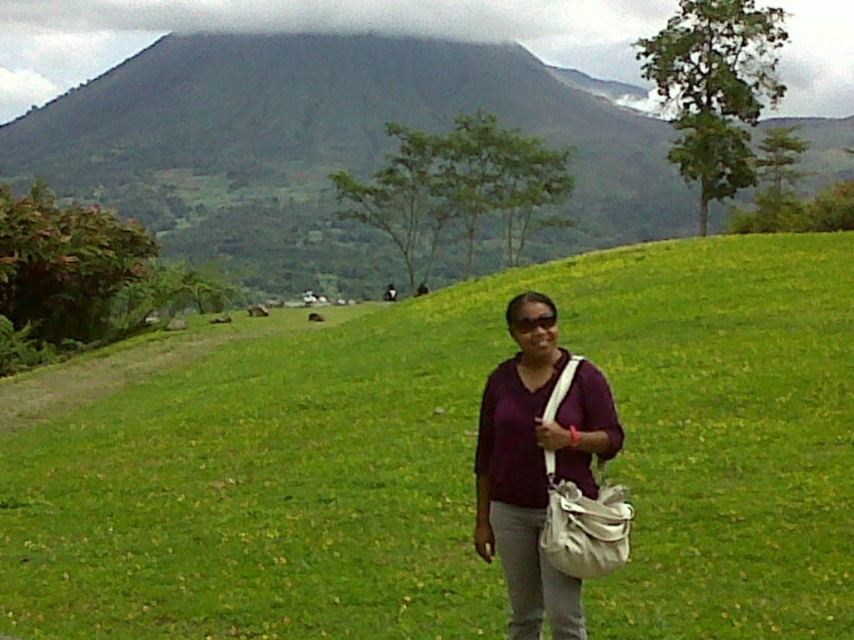
Looking at this image, you are standing at the point marked by the coordinates point (325,145) in the image. What is the terrain like under your feet?

The terrain under your feet at point (325,145) is green grassy hillside at center.

You are a photographer planning to take a picture of the green grassy hillside at center. What are the coordinates where you should focus your camera to capture it?

The green grassy hillside at center is located at coordinates point (325,145), so you should focus your camera there.

In the scene shown: You are a photographer trying to capture the best shot of the scene. You notice the green grassy field at center and the green grassy hillside at center. Which of these two areas is positioned closer to your camera lens?

The green grassy field at center is closer to the viewer than the green grassy hillside at center, so the green grassy field at center will appear closer to the camera lens.